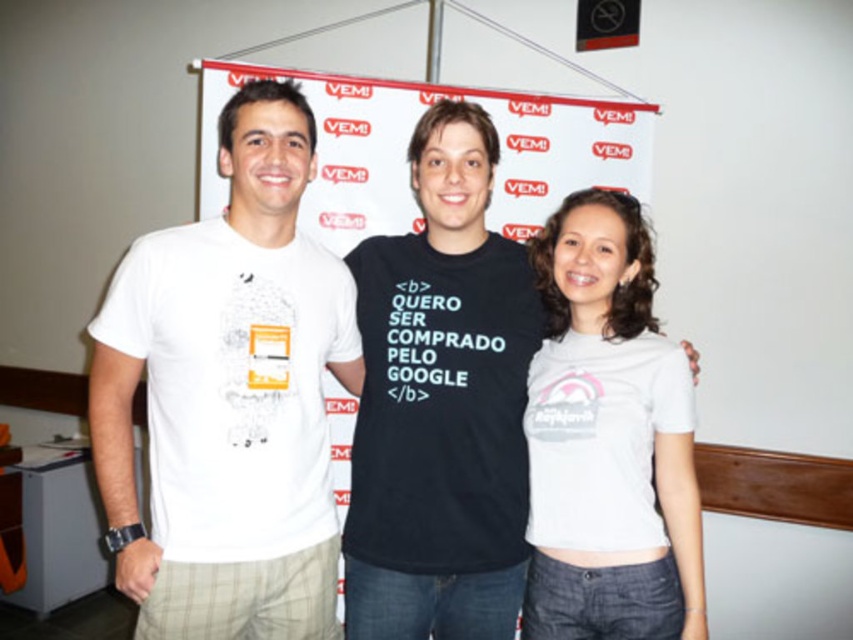
Who is taller, white cotton t-shirt at left or white cotton t-shirt at center?

white cotton t-shirt at left

Image resolution: width=853 pixels, height=640 pixels. What are the coordinates of `white cotton t-shirt at left` in the screenshot? It's located at (228, 397).

Identify the location of white cotton t-shirt at left. Image resolution: width=853 pixels, height=640 pixels. (228, 397).

Who is higher up, white cotton t-shirt at left or black cotton t-shirt at center?

white cotton t-shirt at left is above.

How distant is white cotton t-shirt at left from black cotton t-shirt at center?

white cotton t-shirt at left is 11.03 inches away from black cotton t-shirt at center.

Between point (276, 458) and point (471, 304), which one is positioned in front?

Point (276, 458)

This screenshot has height=640, width=853. Find the location of `white cotton t-shirt at left`. white cotton t-shirt at left is located at coordinates (228, 397).

Does black cotton t-shirt at center have a lesser height compared to white cotton t-shirt at center?

No.

Can you confirm if black cotton t-shirt at center is positioned to the right of white cotton t-shirt at center?

No, black cotton t-shirt at center is not to the right of white cotton t-shirt at center.

Which is in front, point (350, 632) or point (564, 460)?

Point (564, 460) is more forward.

This screenshot has width=853, height=640. I want to click on black cotton t-shirt at center, so click(x=440, y=403).